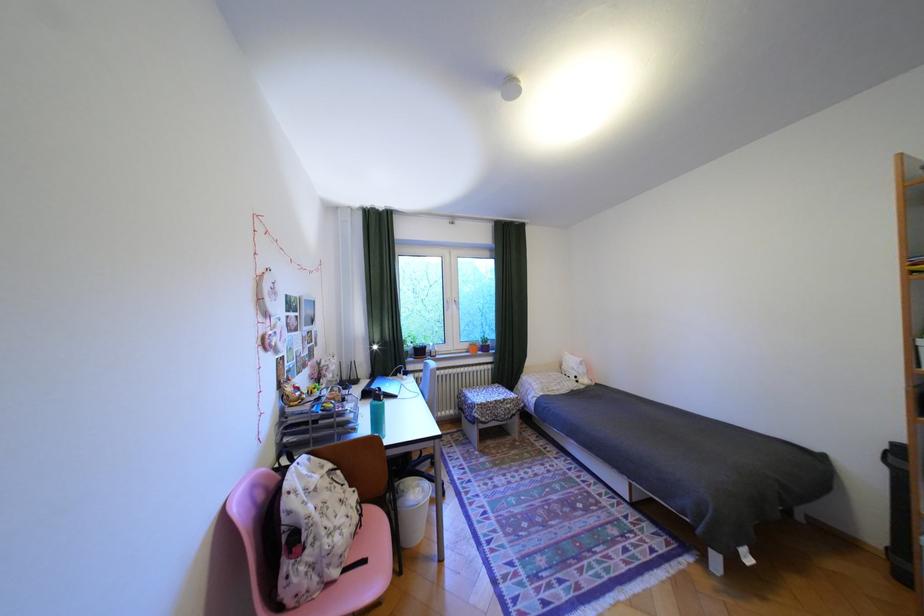
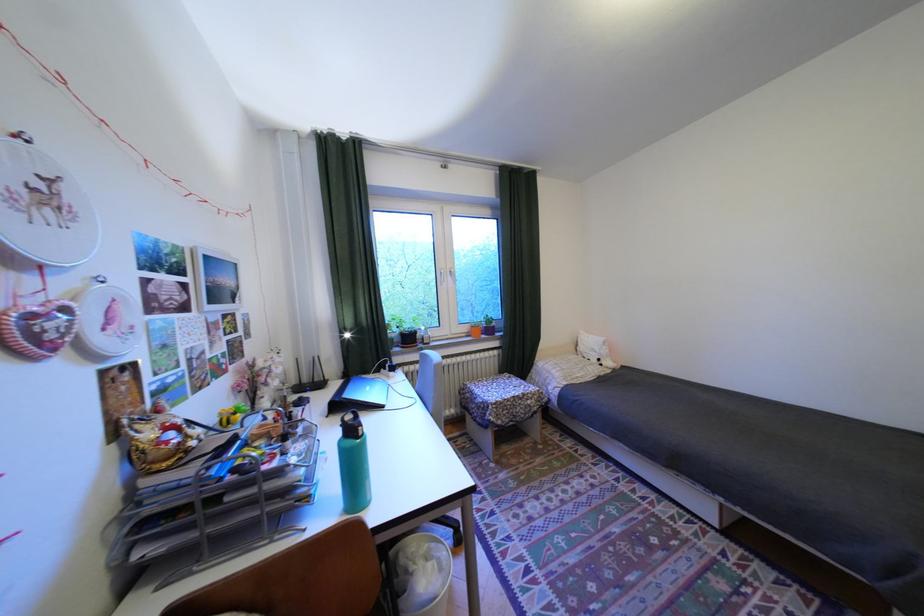
Question: Which direction would the cameraman need to move to produce the second image? Reply with the corresponding letter.

Choices:
 (A) Left
 (B) Right
 (C) Forward
 (D) Backward

Answer: (C)